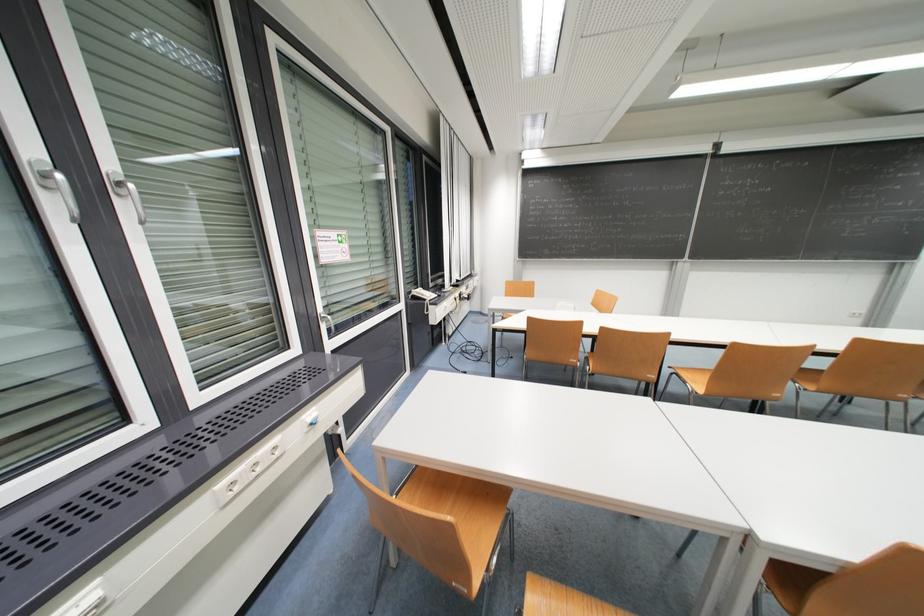
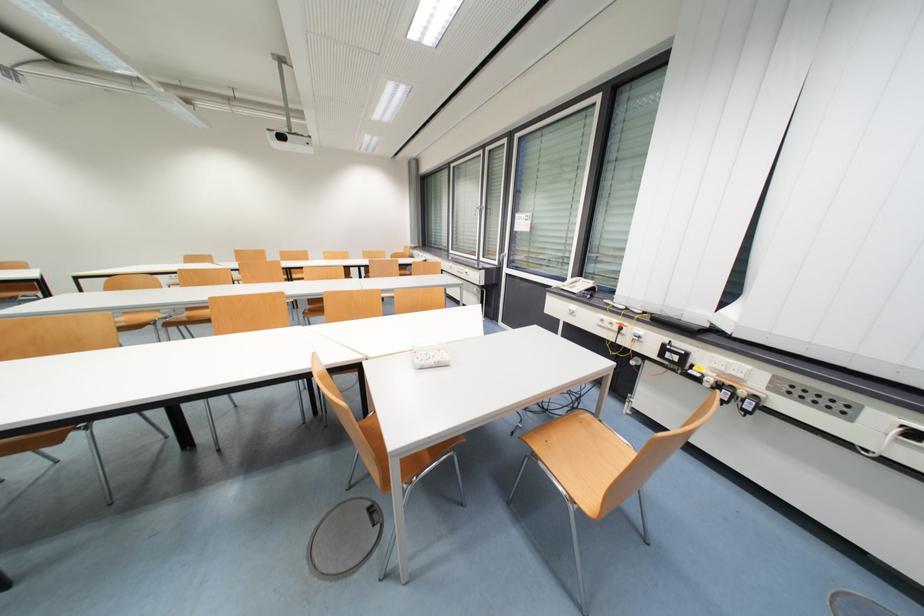
Locate, in the second image, the point that corresponds to (466,297) in the first image.

(671, 350)